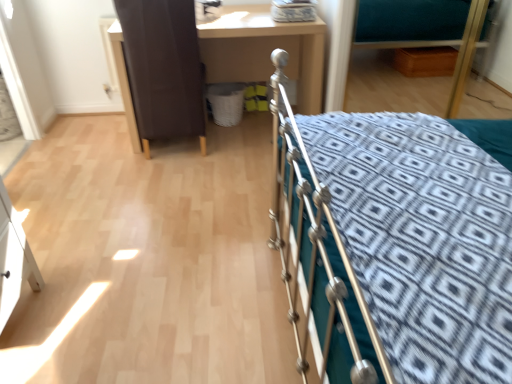
Where is `unoccupied area in front of matte brown desk at center`? The width and height of the screenshot is (512, 384). unoccupied area in front of matte brown desk at center is located at coordinates (189, 189).